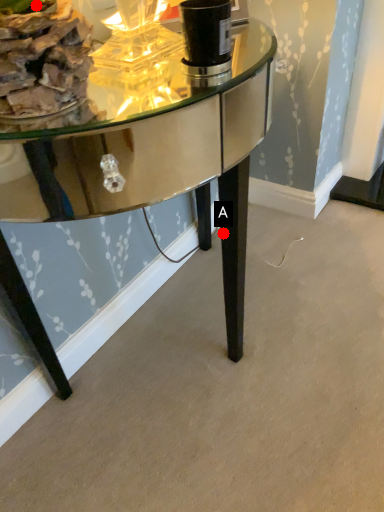
Question: Two points are circled on the image, labeled by A and B beside each circle. Which point is further to the camera?

Choices:
 (A) A is further
 (B) B is further

Answer: (A)